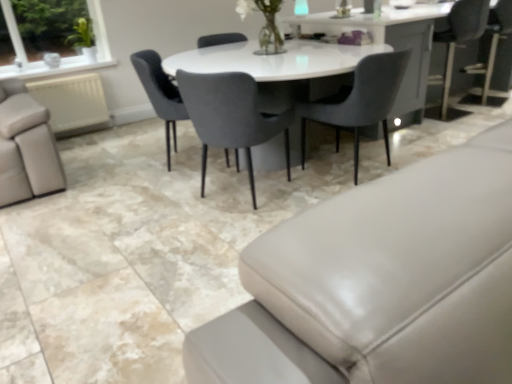
Question: From a real-world perspective, is matte gray chair at center, which is counted as the 3th chair, starting from the right, above or below velvet grey chair at center, the 3th chair in the left-to-right sequence?

Choices:
 (A) below
 (B) above

Answer: (B)

Question: Relative to velvet grey chair at center, which is the first chair in right-to-left order, is matte gray chair at center, which is counted as the 3th chair, starting from the right, in front or behind?

Choices:
 (A) behind
 (B) front

Answer: (A)

Question: Estimate the real-world distances between objects in this image. Which object is farther from the velvet grey chair at center, marked as the 2th chair in a right-to-left arrangement?

Choices:
 (A) clear glass vase at upper center
 (B) matte gray chair at center, which is counted as the 3th chair, starting from the right
 (C) velvet grey chair at center, which is the first chair in right-to-left order
 (D) matte gray couch at lower right

Answer: (D)

Question: Estimate the real-world distances between objects in this image. Which object is farther from the matte gray couch at lower right?

Choices:
 (A) velvet grey chair at center, the 3th chair in the left-to-right sequence
 (B) matte gray chair at center, which appears as the first chair when viewed from the left
 (C) clear glass vase at upper center
 (D) velvet grey chair at center, acting as the second chair starting from the left

Answer: (C)